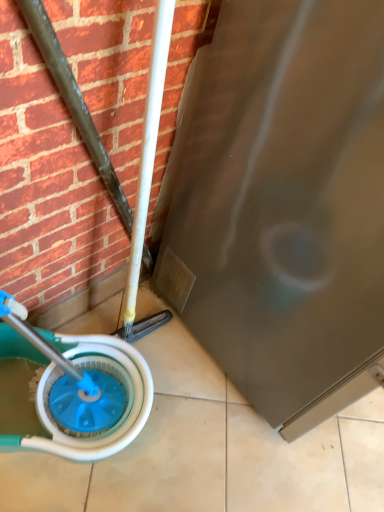
Question: From a real-world perspective, is satin silver screen door at lower right positioned above or below blue plastic wheel at lower left?

Choices:
 (A) below
 (B) above

Answer: (B)

Question: Considering the relative positions of satin silver screen door at lower right and blue plastic wheel at lower left in the image provided, is satin silver screen door at lower right to the left or to the right of blue plastic wheel at lower left?

Choices:
 (A) right
 (B) left

Answer: (A)

Question: Is satin silver screen door at lower right wider or thinner than blue plastic wheel at lower left?

Choices:
 (A) thin
 (B) wide

Answer: (B)

Question: Visually, is blue plastic wheel at lower left positioned to the left or to the right of satin silver screen door at lower right?

Choices:
 (A) left
 (B) right

Answer: (A)

Question: From a real-world perspective, is blue plastic wheel at lower left positioned above or below satin silver screen door at lower right?

Choices:
 (A) above
 (B) below

Answer: (B)

Question: Considering the positions of blue plastic wheel at lower left and satin silver screen door at lower right in the image, is blue plastic wheel at lower left bigger or smaller than satin silver screen door at lower right?

Choices:
 (A) big
 (B) small

Answer: (B)

Question: In terms of height, does blue plastic wheel at lower left look taller or shorter compared to satin silver screen door at lower right?

Choices:
 (A) short
 (B) tall

Answer: (A)